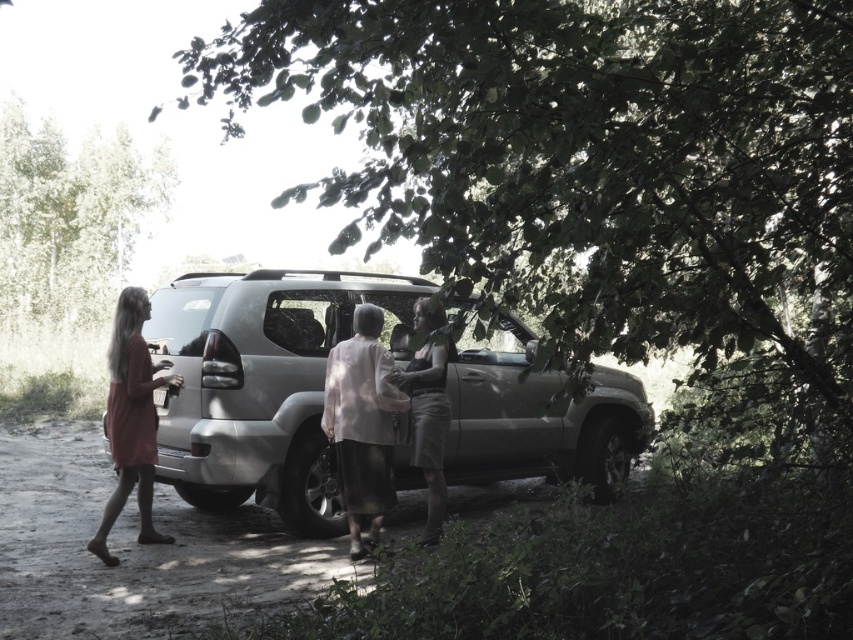
Consider the image. Who is shorter, matte pink dress at left or light beige skirt at center?

With less height is light beige skirt at center.

Can you confirm if matte pink dress at left is bigger than light beige skirt at center?

Indeed, matte pink dress at left has a larger size compared to light beige skirt at center.

Locate an element on the screen. This screenshot has width=853, height=640. matte pink dress at left is located at coordinates (131, 419).

Which is above, green leafy tree at center or satin silver jeep at center?

green leafy tree at center

Which is more to the left, green leafy tree at center or satin silver jeep at center?

From the viewer's perspective, green leafy tree at center appears more on the left side.

Which is behind, point (544, 32) or point (152, 330)?

Positioned behind is point (152, 330).

Locate an element on the screen. The width and height of the screenshot is (853, 640). green leafy tree at center is located at coordinates (596, 176).

Between green leafy tree at upper left and light beige skirt at center, which one is positioned lower?

light beige skirt at center is lower down.

Which of these two, green leafy tree at upper left or light beige skirt at center, stands shorter?

Standing shorter between the two is light beige skirt at center.

What do you see at coordinates (70, 218) in the screenshot? I see `green leafy tree at upper left` at bounding box center [70, 218].

Image resolution: width=853 pixels, height=640 pixels. Identify the location of green leafy tree at upper left. (70, 218).